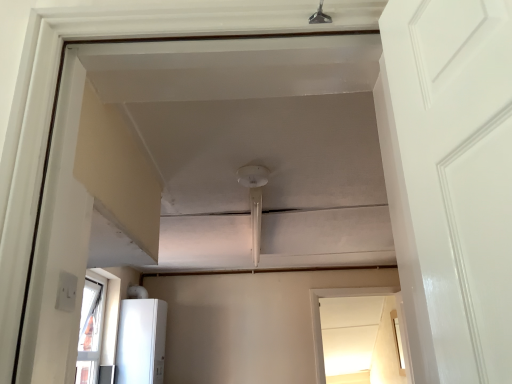
Question: Considering the relative sizes of white glossy refrigerator at lower left and transparent glass window at center in the image provided, is white glossy refrigerator at lower left shorter than transparent glass window at center?

Choices:
 (A) no
 (B) yes

Answer: (B)

Question: Can you confirm if white glossy refrigerator at lower left is bigger than transparent glass window at center?

Choices:
 (A) yes
 (B) no

Answer: (A)

Question: Is the position of white glossy refrigerator at lower left more distant than that of transparent glass window at center?

Choices:
 (A) no
 (B) yes

Answer: (A)

Question: Would you say white glossy refrigerator at lower left is outside transparent glass window at center?

Choices:
 (A) yes
 (B) no

Answer: (A)

Question: Is white glossy refrigerator at lower left aimed at transparent glass window at center?

Choices:
 (A) yes
 (B) no

Answer: (A)

Question: From a real-world perspective, is white glossy refrigerator at lower left on top of transparent glass window at center?

Choices:
 (A) no
 (B) yes

Answer: (B)

Question: Is transparent glass window at center thinner than white glossy refrigerator at lower left?

Choices:
 (A) no
 (B) yes

Answer: (B)

Question: From a real-world perspective, is transparent glass window at center physically below white glossy refrigerator at lower left?

Choices:
 (A) yes
 (B) no

Answer: (A)

Question: Can you confirm if transparent glass window at center is shorter than white glossy refrigerator at lower left?

Choices:
 (A) yes
 (B) no

Answer: (B)

Question: Is the position of transparent glass window at center more distant than that of white glossy refrigerator at lower left?

Choices:
 (A) yes
 (B) no

Answer: (A)

Question: Does transparent glass window at center lie in front of white glossy refrigerator at lower left?

Choices:
 (A) yes
 (B) no

Answer: (B)

Question: Considering the relative positions of transparent glass window at center and white glossy refrigerator at lower left in the image provided, is transparent glass window at center to the left of white glossy refrigerator at lower left from the viewer's perspective?

Choices:
 (A) no
 (B) yes

Answer: (A)

Question: Based on their sizes in the image, would you say white glossy refrigerator at lower left is bigger or smaller than transparent glass window at center?

Choices:
 (A) big
 (B) small

Answer: (A)